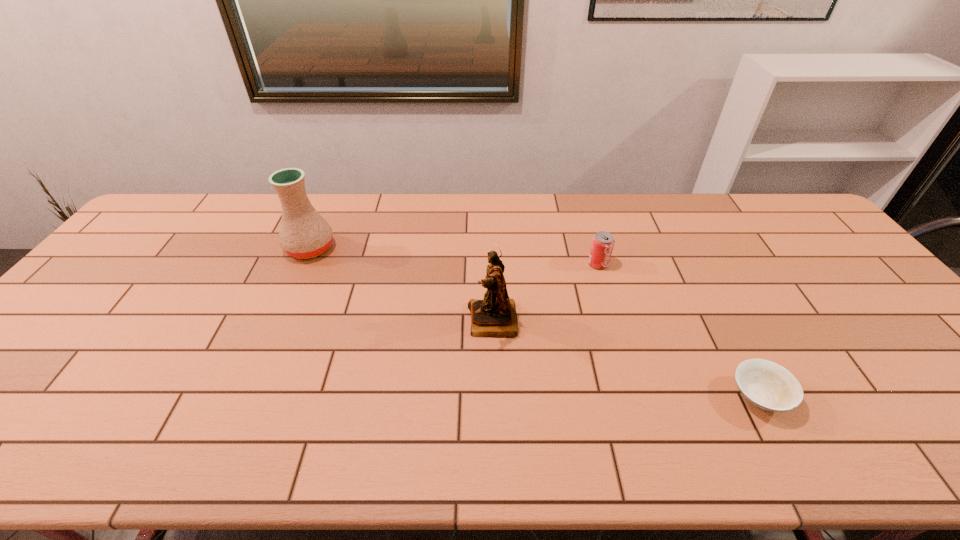
This screenshot has width=960, height=540. In order to click on free space at the far right corner of the desktop in this screenshot , I will do `click(775, 208)`.

In order to click on vacant region between the bowl and the third farthest object in this screenshot , I will do `click(626, 359)`.

At what (x,y) coordinates should I click in order to perform the action: click on unoccupied position between the third object from right to left and the pottery. Please return your answer as a coordinate pair (x, y). This screenshot has height=540, width=960. Looking at the image, I should click on (401, 285).

What are the coordinates of `vacant space that is in between the bowl and the third farthest object` in the screenshot? It's located at (626, 359).

The width and height of the screenshot is (960, 540). I want to click on vacant space that's between the nearest object and the leftmost object, so click(535, 322).

Locate an element on the screen. The height and width of the screenshot is (540, 960). empty location between the bowl and the third object from right to left is located at coordinates (626, 359).

Where is `empty space that is in between the figurine and the leftmost object`? This screenshot has height=540, width=960. empty space that is in between the figurine and the leftmost object is located at coordinates (401, 285).

This screenshot has height=540, width=960. I want to click on vacant area between the third farthest object and the pottery, so click(401, 285).

Where is `vacant point located between the rightmost object and the figurine`? This screenshot has height=540, width=960. vacant point located between the rightmost object and the figurine is located at coordinates (626, 359).

At what (x,y) coordinates should I click in order to perform the action: click on free point between the pottery and the bowl. Please return your answer as a coordinate pair (x, y). The image size is (960, 540). Looking at the image, I should click on (535, 322).